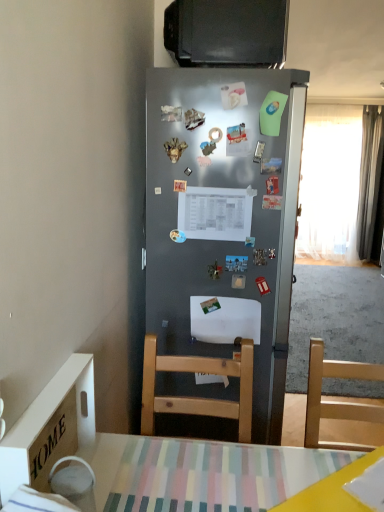
Question: Is point (317, 361) positioned closer to the camera than point (367, 185)?

Choices:
 (A) farther
 (B) closer

Answer: (B)

Question: Is light wood chair at lower right situated inside silky gray curtain at right, the second curtain when ordered from left to right, or outside?

Choices:
 (A) outside
 (B) inside

Answer: (A)

Question: Which is nearer to the gold metallic crown at center, placed as the 7th magnet when sorted from top to bottom?

Choices:
 (A) metallic silver magnet at center, positioned as the eighth magnet in bottom-to-top order
 (B) metallic silver magnet at upper center, which appears as the 9th magnet when viewed from the top
 (C) metallic silver magnet at center, marked as the 1th magnet in a bottom-to-top arrangement
 (D) green matte magnet at upper right, marked as the 3th magnet in a top-to-bottom arrangement
 (E) metallic silver airplane at center, which is the 5th magnet from top to bottom

Answer: (A)

Question: Based on their relative distances, which object is nearer to the metallic silver magnet at center, marked as the 11th magnet in a top-to-bottom arrangement?

Choices:
 (A) metallic silver airplane at center, which ranks as the seventh magnet in bottom-to-top order
 (B) metallic silver magnet at center, positioned as the eighth magnet in bottom-to-top order
 (C) metallic ring at center, the sixth magnet viewed from the top
 (D) green matte magnet at upper right, which is the ninth magnet from bottom to top
 (E) metallic rectangular magnet at center, which is counted as the 4th magnet, starting from the bottom

Answer: (C)